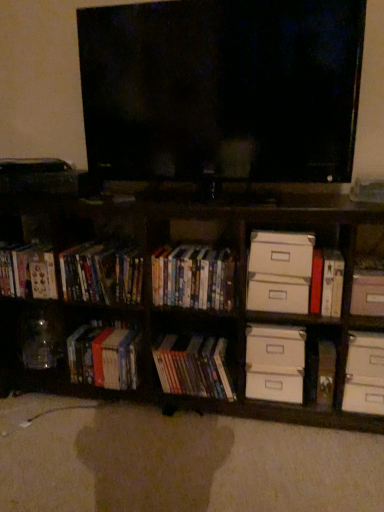
The image size is (384, 512). Identify the location of free space above hardcover book at left, acting as the 1th book starting from the left (from a real-world perspective). (30, 248).